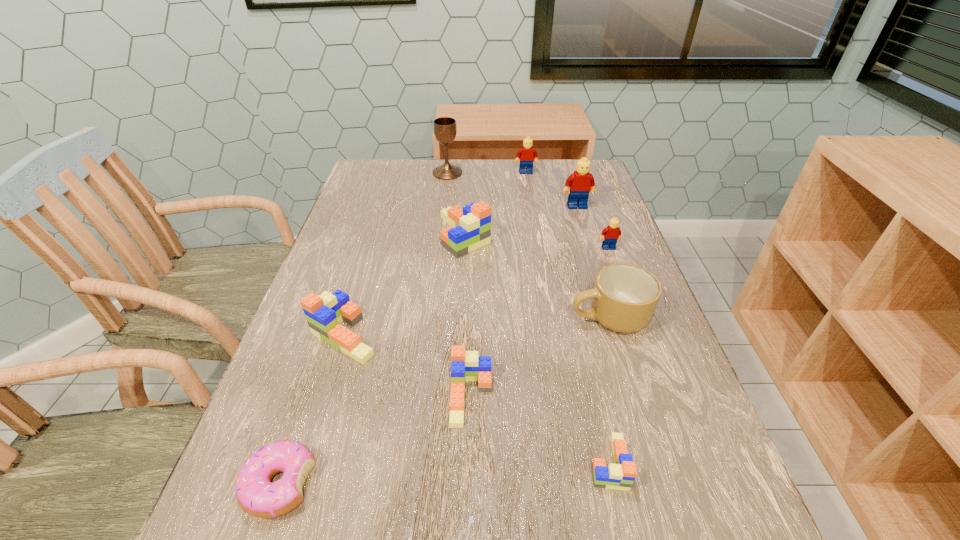
Where is `doughnut that is positioned at the left edge`? Image resolution: width=960 pixels, height=540 pixels. doughnut that is positioned at the left edge is located at coordinates (259, 497).

Find the location of a particular element. mug that is at the right edge is located at coordinates (624, 298).

Image resolution: width=960 pixels, height=540 pixels. In the image, there is a desktop. What are the coordinates of `free space at the far edge` in the screenshot? It's located at (515, 165).

Find the location of a particular element. vacant space at the left edge is located at coordinates (338, 262).

This screenshot has height=540, width=960. What are the coordinates of `free space at the right edge of the desktop` in the screenshot? It's located at (681, 532).

This screenshot has width=960, height=540. I want to click on free space at the far left corner of the desktop, so click(372, 164).

What are the coordinates of `free space at the far right corner of the desktop` in the screenshot? It's located at (602, 189).

I want to click on vacant space in between the second biggest yellow Lego and the biggest orange Lego, so click(495, 203).

Find the location of a particular element. The height and width of the screenshot is (540, 960). free space between the chalice and the shortest Lego is located at coordinates [x=528, y=318].

Identify the location of vacant space that is in between the tan mug and the chalice. (528, 245).